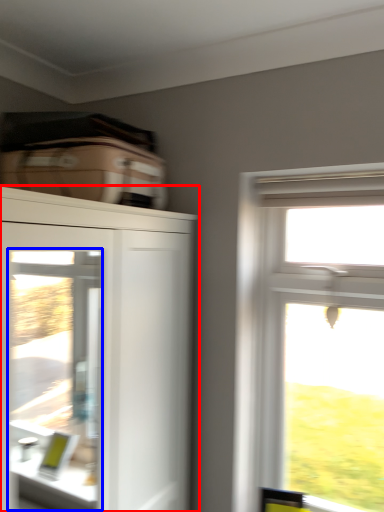
Question: Among these objects, which one is nearest to the camera, cupboard (highlighted by a red box) or screen door (highlighted by a blue box)?

Choices:
 (A) cupboard
 (B) screen door

Answer: (A)